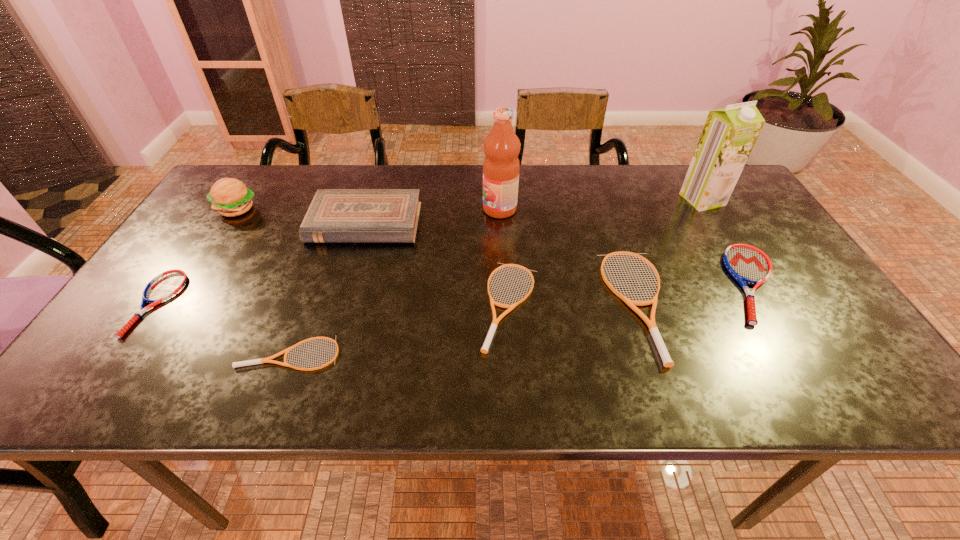
The height and width of the screenshot is (540, 960). Find the location of `free space located on the spine side of the blue Bible`. free space located on the spine side of the blue Bible is located at coordinates (335, 323).

The image size is (960, 540). I want to click on vacant space located 0.180m on the right of the seventh object from left to right, so click(746, 305).

The image size is (960, 540). I want to click on free region located 0.120m on the back of the right blue tennis racket, so click(713, 220).

You are a GUI agent. You are given a task and a screenshot of the screen. Output one action in this format:
    pyautogui.click(x=<x>, y=<y>)
    Task: Click on the vacant region located 0.110m on the back of the second biggest beige tennis racket
    This screenshot has height=540, width=960.
    Given the screenshot: What is the action you would take?
    pyautogui.click(x=506, y=237)

Locate an element on the screen. This screenshot has height=540, width=960. free spot located 0.130m on the right of the leftmost tennis racket is located at coordinates coord(230,303).

The width and height of the screenshot is (960, 540). What are the coordinates of `free spot located 0.290m on the left of the leftmost beige tennis racket` in the screenshot? It's located at (102, 353).

Where is `soya milk that is at the far edge`? This screenshot has width=960, height=540. soya milk that is at the far edge is located at coordinates (729, 134).

The height and width of the screenshot is (540, 960). I want to click on fruit juice at the far edge, so click(x=501, y=166).

You are a GUI agent. You are given a task and a screenshot of the screen. Output one action in this format:
    pyautogui.click(x=<x>, y=<y>)
    Task: Click on the hamburger that is at the far edge
    
    Given the screenshot: What is the action you would take?
    pyautogui.click(x=229, y=196)

What are the coordinates of `Bible that is positioned at the far edge` in the screenshot? It's located at (335, 215).